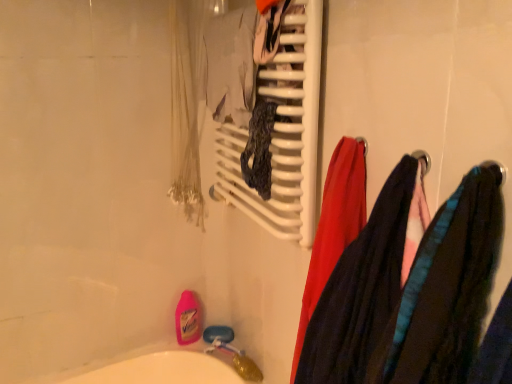
Question: From the image's perspective, is velvet-like fabric at right, the 2th clothing in the front-to-back sequence, above velvet-like fabric scarf at right, the first clothing when ordered from front to back?

Choices:
 (A) no
 (B) yes

Answer: (A)

Question: Is the position of velvet-like fabric at right, the 2th clothing in the front-to-back sequence, more distant than that of velvet-like fabric scarf at right, which is counted as the second clothing, starting from the back?

Choices:
 (A) yes
 (B) no

Answer: (A)

Question: Is velvet-like fabric at right, the 2th clothing in the front-to-back sequence, surrounding velvet-like fabric scarf at right, which is counted as the second clothing, starting from the back?

Choices:
 (A) no
 (B) yes

Answer: (A)

Question: From a real-world perspective, is velvet-like fabric at right, the 1th clothing positioned from the back, on velvet-like fabric scarf at right, which is counted as the second clothing, starting from the back?

Choices:
 (A) no
 (B) yes

Answer: (A)

Question: Can you confirm if velvet-like fabric at right, the 1th clothing positioned from the back, is shorter than velvet-like fabric scarf at right, the first clothing when ordered from front to back?

Choices:
 (A) yes
 (B) no

Answer: (B)

Question: Is velvet-like fabric at right, the 2th clothing in the front-to-back sequence, positioned in front of velvet-like fabric scarf at right, the first clothing when ordered from front to back?

Choices:
 (A) no
 (B) yes

Answer: (A)

Question: Considering the relative sizes of velvet-like fabric scarf at right, which is counted as the second clothing, starting from the back, and white plastic towel rack at upper center in the image provided, is velvet-like fabric scarf at right, which is counted as the second clothing, starting from the back, thinner than white plastic towel rack at upper center?

Choices:
 (A) yes
 (B) no

Answer: (B)

Question: From a real-world perspective, is velvet-like fabric scarf at right, the first clothing when ordered from front to back, positioned under white plastic towel rack at upper center based on gravity?

Choices:
 (A) yes
 (B) no

Answer: (A)

Question: Does velvet-like fabric scarf at right, the first clothing when ordered from front to back, have a greater width compared to white plastic towel rack at upper center?

Choices:
 (A) no
 (B) yes

Answer: (B)

Question: Does velvet-like fabric scarf at right, the first clothing when ordered from front to back, appear on the right side of white plastic towel rack at upper center?

Choices:
 (A) yes
 (B) no

Answer: (A)

Question: Is velvet-like fabric scarf at right, which is counted as the second clothing, starting from the back, shorter than white plastic towel rack at upper center?

Choices:
 (A) no
 (B) yes

Answer: (B)

Question: From the image's perspective, would you say velvet-like fabric scarf at right, the first clothing when ordered from front to back, is shown under white plastic towel rack at upper center?

Choices:
 (A) no
 (B) yes

Answer: (B)

Question: Does white plastic towel rack at upper center have a greater height compared to velvet-like fabric at right, the 1th clothing positioned from the back?

Choices:
 (A) no
 (B) yes

Answer: (B)